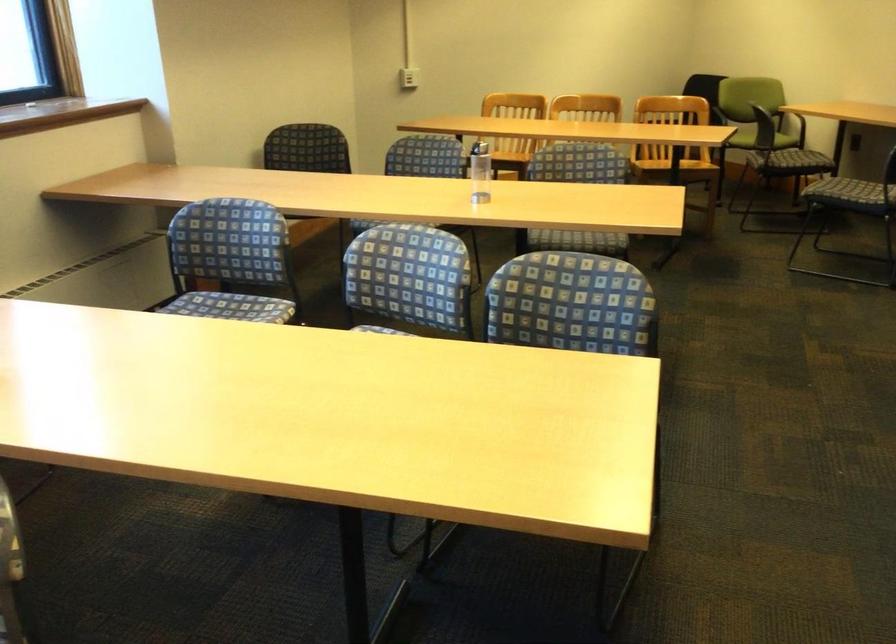
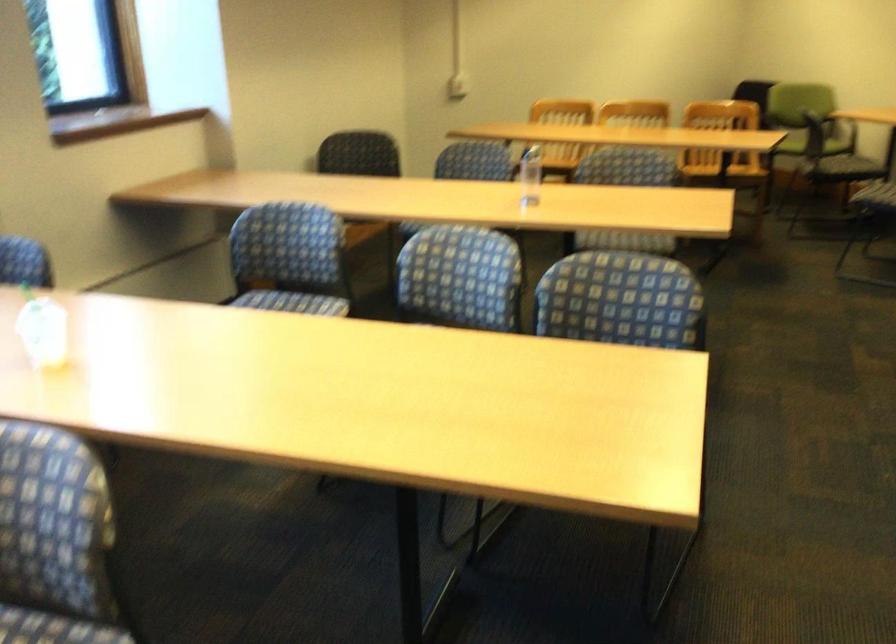
Find the pixel in the second image that matches point (409, 79) in the first image.

(458, 86)